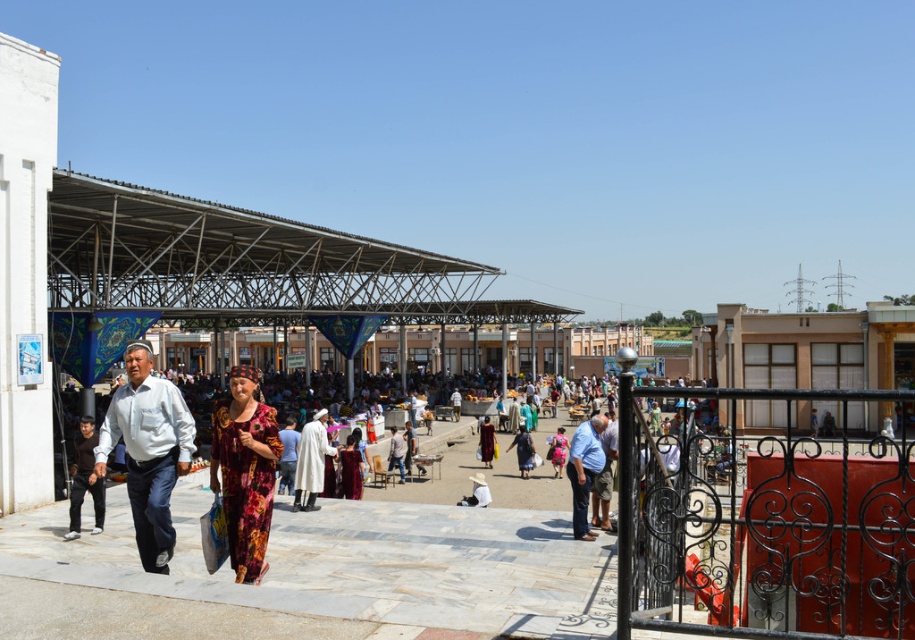
Question: Which of these objects is positioned closest to the pink floral dress at center?

Choices:
 (A) floral fabric dress at center
 (B) dark brown fabric dress at center
 (C) white cotton shirt at left
 (D) dark brown leather jacket at lower left

Answer: (B)

Question: From the image, what is the correct spatial relationship of floral fabric dress at center in relation to dark brown fabric dress at center?

Choices:
 (A) left
 (B) right

Answer: (A)

Question: Is blue jeans at center to the left of blue fabric dress at center from the viewer's perspective?

Choices:
 (A) yes
 (B) no

Answer: (B)

Question: Which of the following is the farthest from the observer?

Choices:
 (A) (522, 426)
 (B) (149, 429)
 (C) (491, 458)

Answer: (A)

Question: Does white cotton robe at center have a greater width compared to dark brown fabric dress at center?

Choices:
 (A) yes
 (B) no

Answer: (A)

Question: Estimate the real-world distances between objects in this image. Which object is closer to the pink floral dress at center?

Choices:
 (A) white fabric hat at center
 (B) white cotton robe at center
 (C) blue jeans at center

Answer: (A)